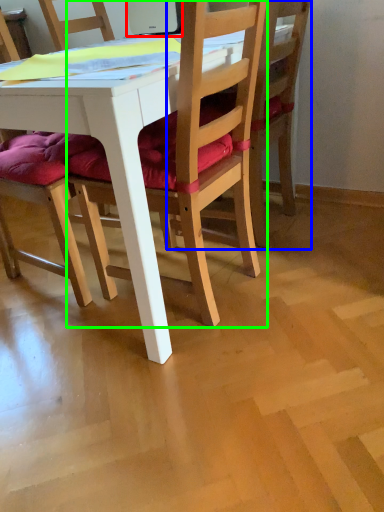
Question: Based on their relative distances, which object is nearer to laptop (highlighted by a red box)? Choose from chair (highlighted by a blue box) and chair (highlighted by a green box).

Choices:
 (A) chair
 (B) chair

Answer: (A)